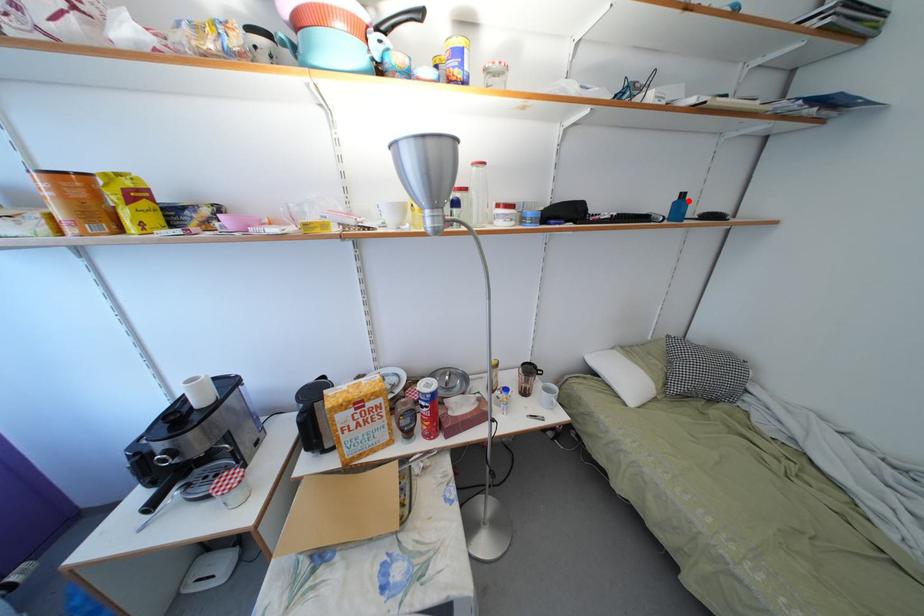
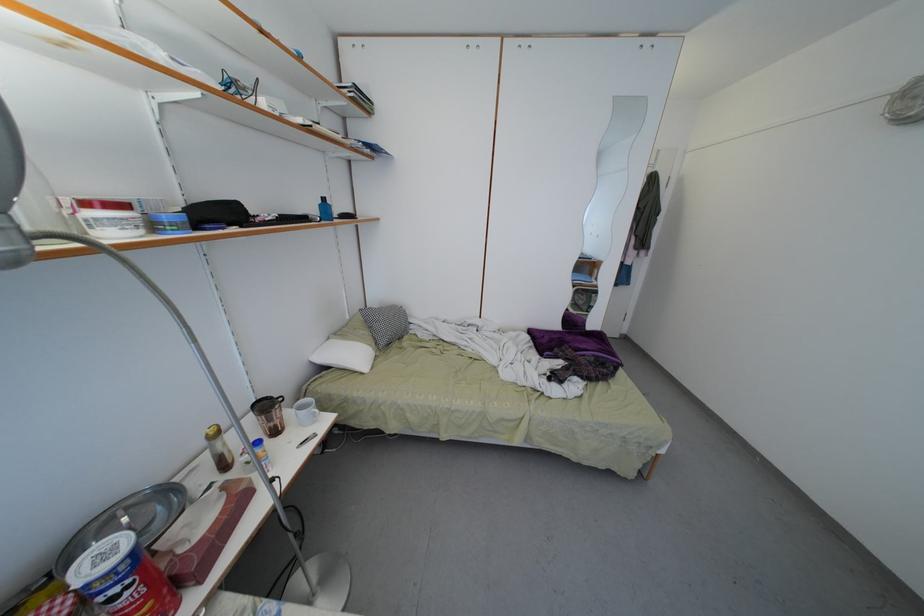
Locate, in the second image, the point that corresponds to the highlighted location in the first image.

(330, 205)